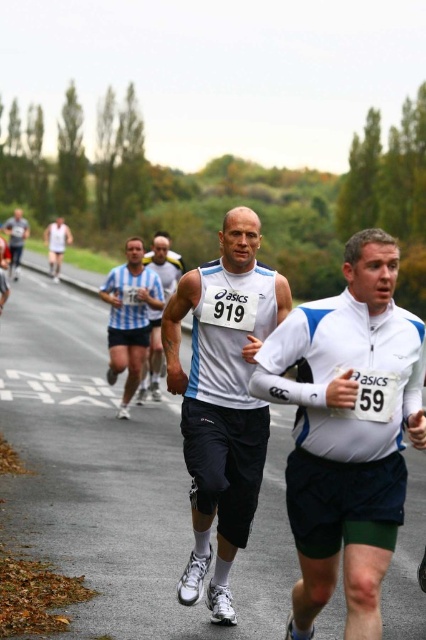
Who is lower down, blue striped shirt at center or white athletic shirt at center?

Positioned lower is blue striped shirt at center.

Is blue striped shirt at center below white athletic shirt at center?

Yes, blue striped shirt at center is below white athletic shirt at center.

Is point (141, 289) closer to camera compared to point (17, 273)?

Yes, point (141, 289) is closer to viewer.

This screenshot has width=426, height=640. I want to click on blue striped shirt at center, so click(x=129, y=317).

Which is in front, point (368, 616) or point (129, 394)?

Point (368, 616)

Is white matte running shirt at center thinner than blue striped shirt at center?

Yes, white matte running shirt at center is thinner than blue striped shirt at center.

Locate an element on the screen. This screenshot has width=426, height=640. white matte running shirt at center is located at coordinates (345, 433).

Identify the location of white matte running shirt at center. The height and width of the screenshot is (640, 426). (345, 433).

Can you confirm if white matte running shirt at center is positioned to the left of white matte running shorts at center?

No, white matte running shirt at center is not to the left of white matte running shorts at center.

Who is taller, white matte running shirt at center or white matte running shorts at center?

Standing taller between the two is white matte running shorts at center.

Where is `white matte running shirt at center`? white matte running shirt at center is located at coordinates (345, 433).